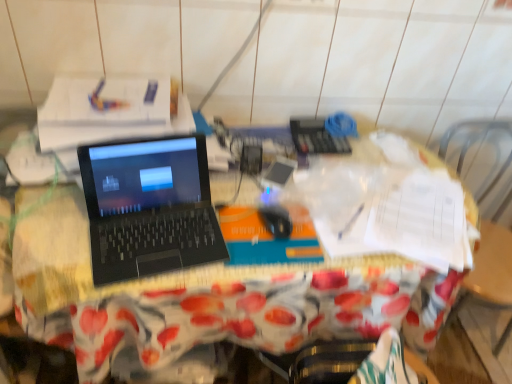
This screenshot has width=512, height=384. What do you see at coordinates (255, 264) in the screenshot? I see `black plastic laptop at center` at bounding box center [255, 264].

I want to click on black matte mouse at center, so click(276, 220).

Image resolution: width=512 pixels, height=384 pixels. What do you see at coordinates (149, 207) in the screenshot?
I see `black matte laptop at center` at bounding box center [149, 207].

Find the location of a particular element. black matte laptop at center is located at coordinates (149, 207).

Where is `black plastic laptop at center`? black plastic laptop at center is located at coordinates (255, 264).

Is black matte mouse at center further to the viewer compared to black plastic laptop at center?

Yes, black matte mouse at center is further from the viewer.

Would you say black matte mouse at center is to the left or to the right of black plastic laptop at center in the picture?

black matte mouse at center is to the right of black plastic laptop at center.

Does black matte mouse at center turn towards black plastic laptop at center?

No, black matte mouse at center is not turned towards black plastic laptop at center.

In the scene shown: Does black matte laptop at center lie behind black plastic laptop at center?

No.

Is point (190, 199) in front of point (148, 359)?

No, it is not.

Between black matte laptop at center and black plastic laptop at center, which one has smaller size?

With smaller size is black matte laptop at center.

Which is in front, point (275, 235) or point (102, 169)?

The point (102, 169) is closer.

Is black matte mouse at center not within black matte laptop at center?

Yes, black matte mouse at center is located beyond the bounds of black matte laptop at center.

How many degrees apart are the facing directions of black matte mouse at center and black matte laptop at center?

The angular difference between black matte mouse at center and black matte laptop at center is 1.21 degrees.

Locate an element on the screen. laptop that is on the left side of black matte mouse at center is located at coordinates (149, 207).

From a real-world perspective, is black plastic laptop at center over black matte laptop at center?

No, from a real-world perspective, black plastic laptop at center is not above black matte laptop at center.

Does point (223, 336) lie in front of point (92, 165)?

No, (223, 336) is behind (92, 165).

Based on the photo, are black plastic laptop at center and black matte laptop at center far apart?

No.

Based on their positions, is black plastic laptop at center located to the left or right of black matte laptop at center?

black plastic laptop at center is positioned on black matte laptop at center's right side.

Is black matte laptop at center positioned far away from black matte mouse at center?

No, black matte laptop at center is in close proximity to black matte mouse at center.

Which object is positioned more to the left, black matte laptop at center or black matte mouse at center?

black matte laptop at center.

Is black matte laptop at center looking in the opposite direction of black matte mouse at center?

No.

Is black matte laptop at center located outside black matte mouse at center?

black matte laptop at center lies outside black matte mouse at center's area.

Which is behind, black plastic laptop at center or black matte mouse at center?

black matte mouse at center.

Is black plastic laptop at center positioned far away from black matte mouse at center?

No.

How different are the orientations of black plastic laptop at center and black matte mouse at center in degrees?

black plastic laptop at center and black matte mouse at center are facing 8.33 degrees away from each other.

Is black plastic laptop at center facing towards black matte mouse at center?

No, black plastic laptop at center is not oriented towards black matte mouse at center.

This screenshot has height=384, width=512. I want to click on desk beneath the black matte mouse at center (from a real-world perspective), so click(255, 264).

I want to click on laptop lying on the left of black plastic laptop at center, so click(149, 207).

Looking at the image, which one is located further to black matte laptop at center, black matte mouse at center or black plastic laptop at center?

black matte mouse at center.

When comparing their distances from black matte mouse at center, does black plastic laptop at center or black matte laptop at center seem closer?

black matte laptop at center.

Based on their spatial positions, is black matte laptop at center or black matte mouse at center closer to black plastic laptop at center?

Based on the image, black matte laptop at center appears to be nearer to black plastic laptop at center.

Based on their spatial positions, is black matte mouse at center or black matte laptop at center further from black plastic laptop at center?

black matte mouse at center is positioned further to the anchor black plastic laptop at center.

Considering their positions, is black matte laptop at center positioned further to black matte mouse at center than black plastic laptop at center?

black plastic laptop at center lies further to black matte mouse at center than the other object.

Looking at the image, which one is located further to black matte laptop at center, black plastic laptop at center or black matte mouse at center?

black matte mouse at center is further to black matte laptop at center.

In order to click on mouse that lies between black matte laptop at center and black plastic laptop at center from top to bottom in this screenshot , I will do `click(276, 220)`.